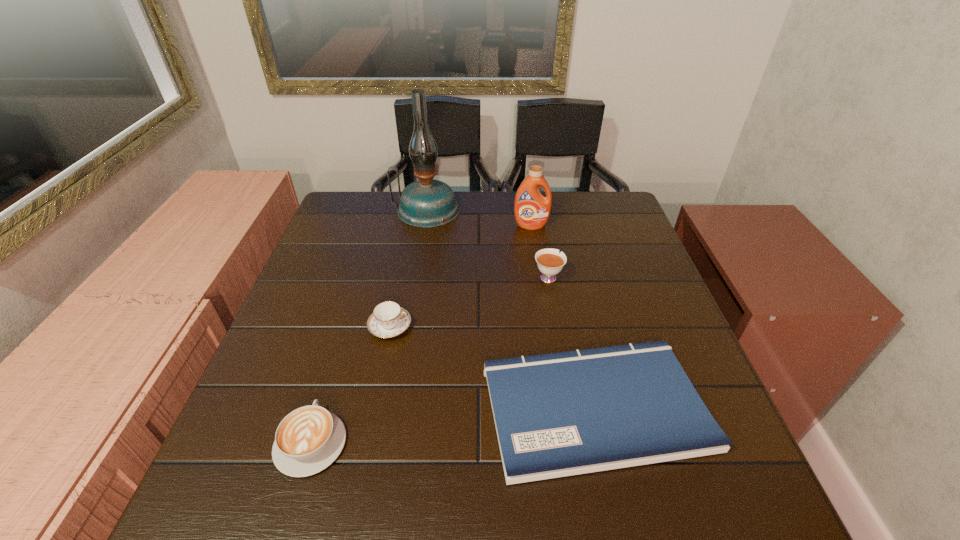
The width and height of the screenshot is (960, 540). Find the location of `free space at the far left corner`. free space at the far left corner is located at coordinates (366, 215).

Image resolution: width=960 pixels, height=540 pixels. In the image, there is a desktop. What are the coordinates of `vacant space at the far right corner` in the screenshot? It's located at (610, 221).

This screenshot has width=960, height=540. In order to click on vacant space at the near right corner in this screenshot , I will do `click(673, 525)`.

You are a GUI agent. You are given a task and a screenshot of the screen. Output one action in this format:
    pyautogui.click(x=<x>, y=<y>)
    Task: Click on the free spot between the cappuccino and the third nearest object
    
    Given the screenshot: What is the action you would take?
    tap(350, 384)

This screenshot has height=540, width=960. What are the coordinates of `empty space between the shortest object and the oil lamp` in the screenshot? It's located at (511, 309).

Where is `vacant space that's between the tallest object and the taller teacup`? This screenshot has width=960, height=540. vacant space that's between the tallest object and the taller teacup is located at coordinates (487, 244).

Identify the location of vacant area that lies between the paperback book and the tallest object. [511, 309].

The image size is (960, 540). I want to click on vacant area that lies between the fifth shortest object and the oil lamp, so coord(479,218).

This screenshot has width=960, height=540. In order to click on empty space that is in between the fourth nearest object and the shortest object in this screenshot , I will do `click(571, 342)`.

Where is `free space between the third nearest object and the tallest object`? This screenshot has width=960, height=540. free space between the third nearest object and the tallest object is located at coordinates (408, 268).